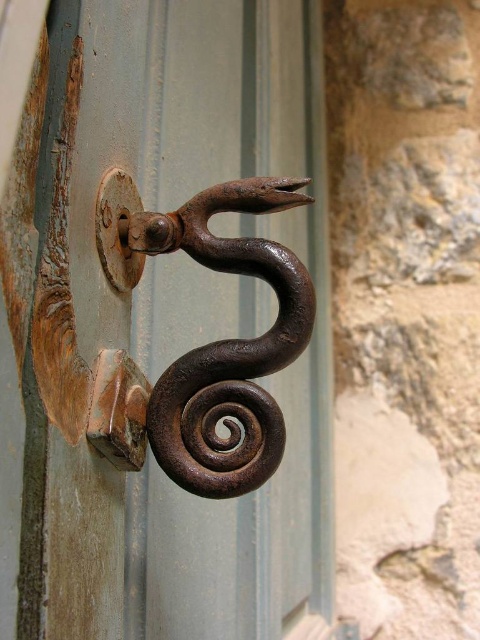
You are standing in front of a door with two hooks. You need to hang a heavy bag on the hook that is to the left. Which hook should you choose between the rusty metal hook at center and the rusty iron hook at center?

You should choose the rusty iron hook at center because the rusty metal hook at center is to the right of it, making the rusty iron hook at center the one on the left.

You are trying to hang a heavy bag on the door handle. The bag weighs 10 kilograms. Which hook should you choose between the rusty metal hook at center and the rusty iron hook at center to ensure it can support the weight?

The rusty metal hook at center is in front of the rusty iron hook at center, so it is closer to you and more accessible. However, the material strength between metal and iron isn

In the scene shown: You are a painter trying to hang a large canvas. You see two hooks on the door handle area. Which hook, the rusty metal hook at center or the rusty iron hook at center, should you choose to ensure it can support the weight?

The rusty metal hook at center is much taller than the rusty iron hook at center, so it is likely stronger and more suitable for supporting the weight of the large canvas.